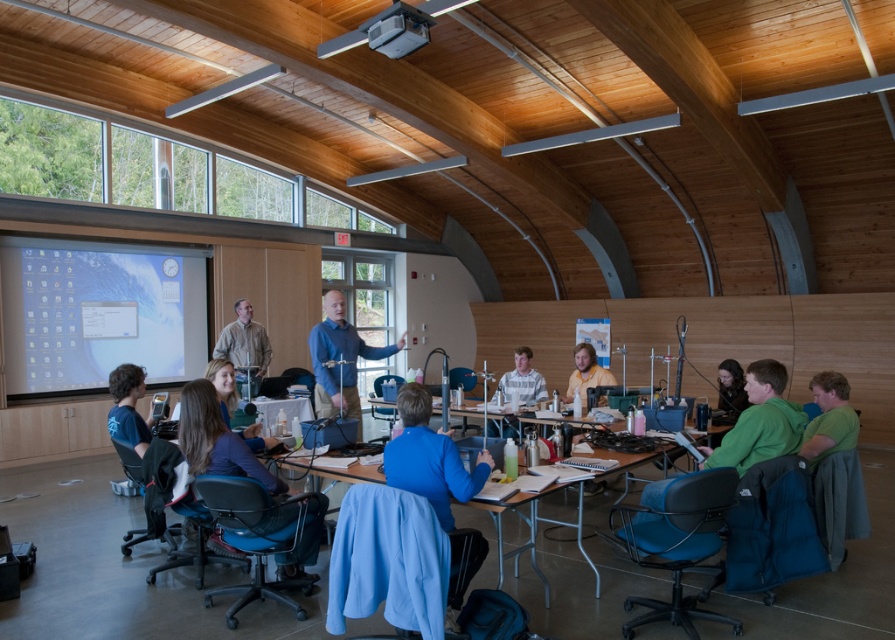
From the picture: Is blue fabric at center below light brown hair at center?

Indeed, blue fabric at center is positioned under light brown hair at center.

Is point (474, 490) positioned before point (505, 376)?

Yes, it is.

Find the location of `blue fabric at center`. blue fabric at center is located at coordinates (439, 484).

Who is more forward, [314,554] or [369,33]?

Point [314,554] is more forward.

Which is more to the right, blue fabric chair at lower left or white plastic projector at upper center?

From the viewer's perspective, white plastic projector at upper center appears more on the right side.

Where is `blue fabric chair at lower left`? The width and height of the screenshot is (895, 640). blue fabric chair at lower left is located at coordinates (244, 472).

This screenshot has width=895, height=640. I want to click on light brown hair at center, so click(x=523, y=378).

At what (x,y) coordinates should I click in order to perform the action: click on light brown hair at center. Please return your answer as a coordinate pair (x, y). This screenshot has height=640, width=895. Looking at the image, I should click on (523, 378).